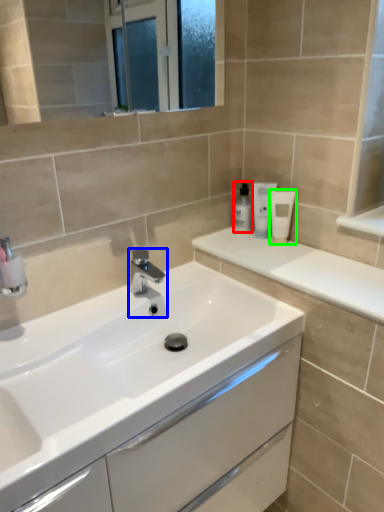
Question: Which object is positioned farthest from toiletry (highlighted by a red box)? Select from tap (highlighted by a blue box) and toiletry (highlighted by a green box).

Choices:
 (A) tap
 (B) toiletry

Answer: (A)